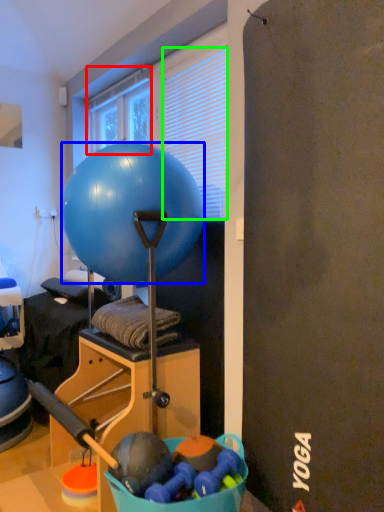
Question: Based on their relative distances, which object is farther from window (highlighted by a red box)? Choose from ball (highlighted by a blue box) and blind (highlighted by a green box).

Choices:
 (A) ball
 (B) blind

Answer: (A)